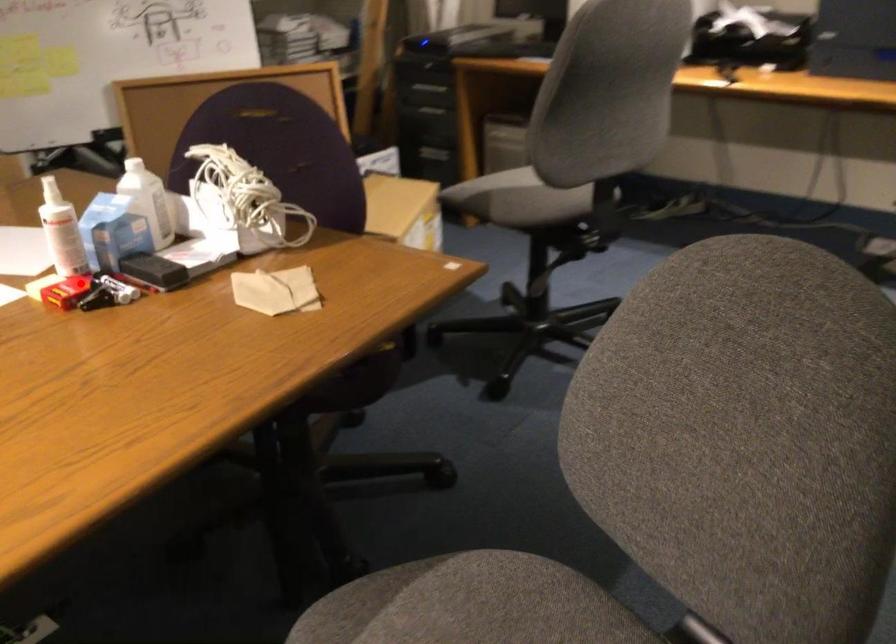
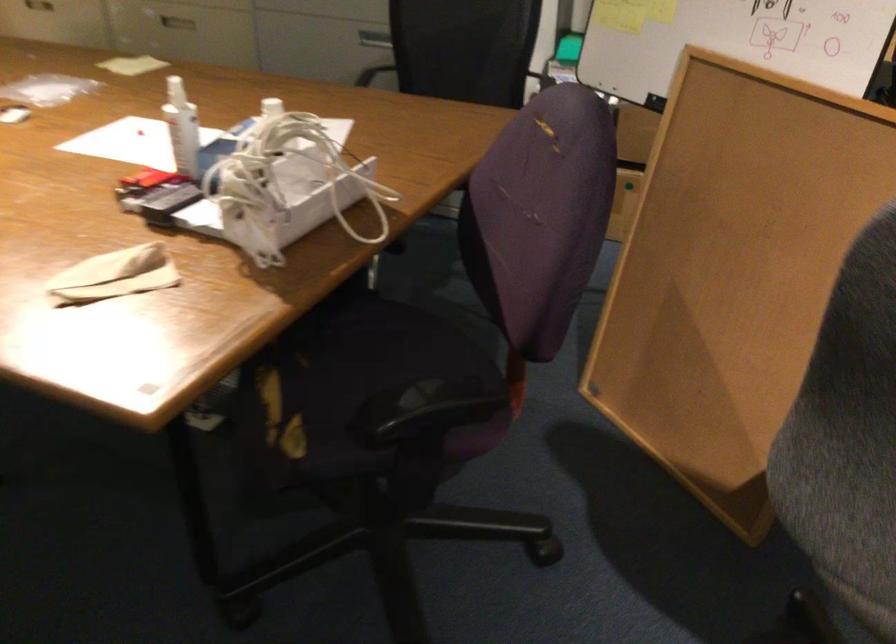
Locate, in the second image, the point that corresponds to the highlighted location in the first image.

(150, 178)